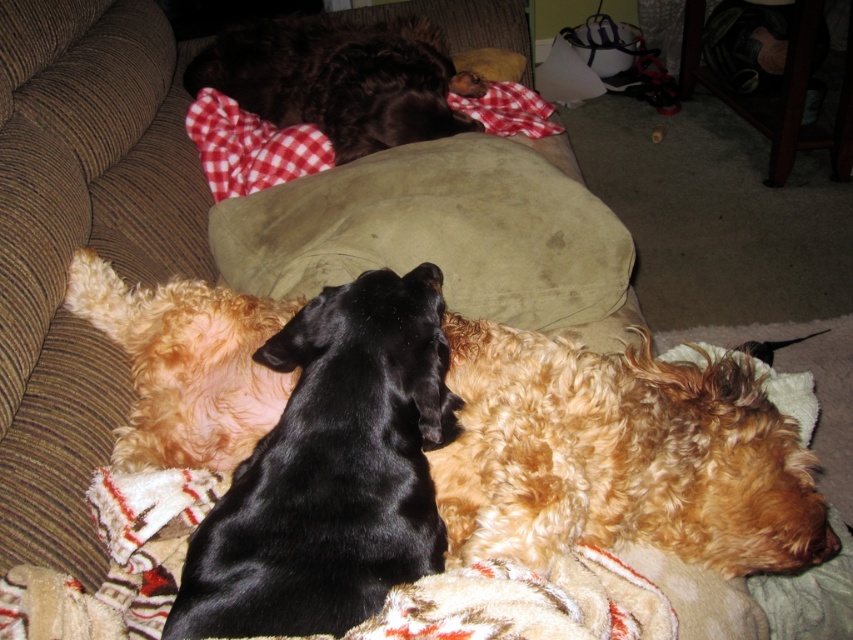
Question: Where is black fur dog at center located in relation to suede cushion at center in the image?

Choices:
 (A) right
 (B) left

Answer: (A)

Question: Can you confirm if golden curly fur at lower right is positioned to the left of curly golden fur at center?

Choices:
 (A) no
 (B) yes

Answer: (A)

Question: Is black fur dog at center to the right of golden curly fur at lower right from the viewer's perspective?

Choices:
 (A) yes
 (B) no

Answer: (B)

Question: Among these points, which one is nearest to the camera?

Choices:
 (A) (775, 436)
 (B) (397, 566)

Answer: (B)

Question: Which is farther from the black fur dog at center?

Choices:
 (A) suede cushion at center
 (B) black smooth dog at center
 (C) shiny brown fur at center

Answer: (C)

Question: Which object is closer to the camera taking this photo?

Choices:
 (A) black smooth dog at center
 (B) curly golden fur at center

Answer: (A)